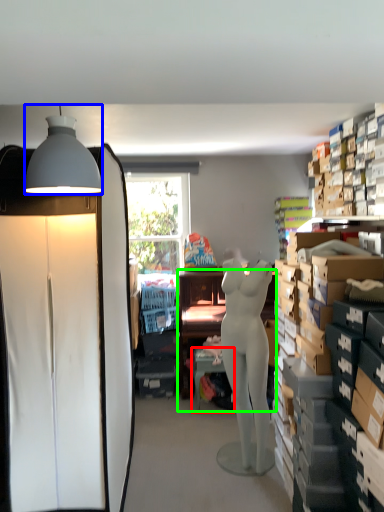
Question: Which is farther away from table (highlighted by a red box)? lamp (highlighted by a blue box) or desk (highlighted by a green box)?

Choices:
 (A) lamp
 (B) desk

Answer: (A)